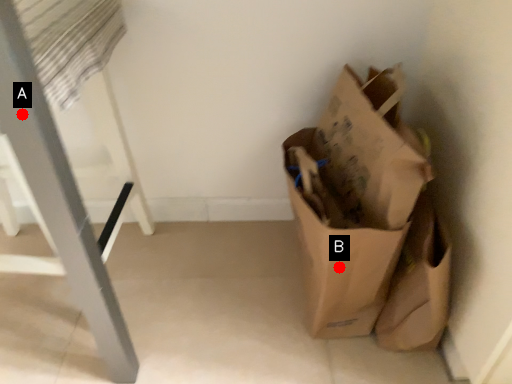
Question: Two points are circled on the image, labeled by A and B beside each circle. Among these points, which one is nearest to the camera?

Choices:
 (A) A is closer
 (B) B is closer

Answer: (A)